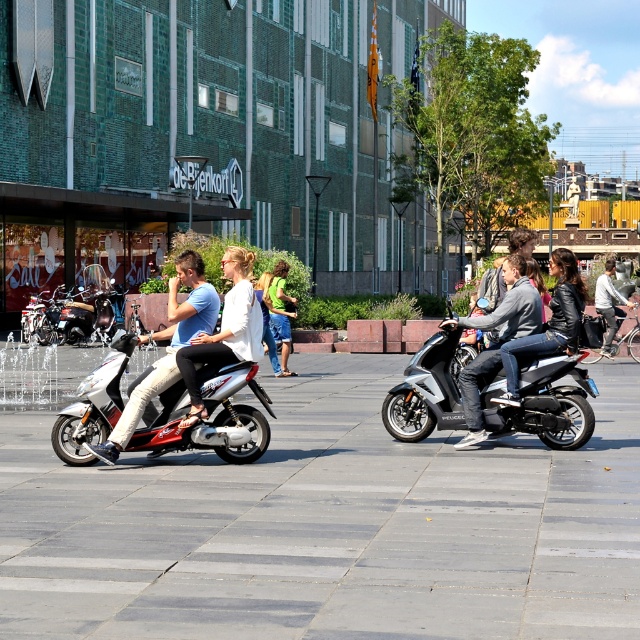
Question: Which point is closer to the camera taking this photo?

Choices:
 (A) (204, 355)
 (B) (589, 362)
 (C) (560, 356)
 (D) (184, 493)

Answer: (D)

Question: Can you confirm if matte white scooter at left is positioned to the left of leather jacket at center?

Choices:
 (A) no
 (B) yes

Answer: (B)

Question: Where is leather jacket at center located in relation to green fabric shirt at center in the image?

Choices:
 (A) below
 (B) above

Answer: (B)

Question: Does shiny metallic scooter at left have a smaller size compared to matte white scooter at center?

Choices:
 (A) yes
 (B) no

Answer: (B)

Question: Considering the real-world distances, which object is closest to the green fabric shirt at center?

Choices:
 (A) matte white scooter at left
 (B) denim jeans at center
 (C) shiny metallic scooter at left
 (D) gray concrete pavement at center

Answer: (D)

Question: Which point is closer to the camera?

Choices:
 (A) metallic silver scooter at center
 (B) denim jeans at center
 (C) gray concrete pavement at center

Answer: (C)